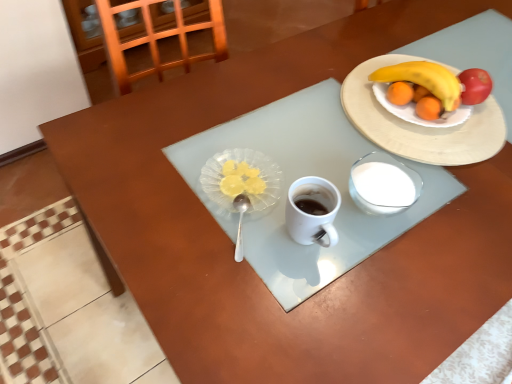
Locate an element on the screen. vacant area that lies in front of white ceramic plate at upper right is located at coordinates (424, 229).